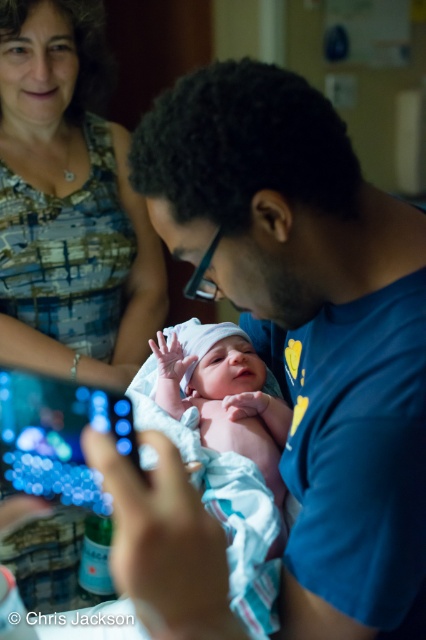
Based on the photo, what is the exact location of the blue printed fabric at upper left in the image?

The blue printed fabric at upper left is located at point coordinates of (69, 205).

You are a nurse standing in the hospital room and need to retrieve the blue printed fabric at upper left to cover the baby. Can you reach it without moving from your current position?

The blue printed fabric at upper left is 1.26 meters away from the viewer, so if the nurse can reach that distance, they can retrieve it without moving. However, if their reach is shorter than 1.26 meters, they might need to step closer.

You are a photographer in a hospital room. You need to capture a photo of the blue printed fabric at upper left and the white clothed newborn at center. Which object should you focus on first if you want to include both in the frame without moving the camera?

The blue printed fabric at upper left is larger in size than the white clothed newborn at center, so you should focus on the blue printed fabric at upper left first to ensure it fits properly in the frame before adjusting for the smaller white clothed newborn at center.